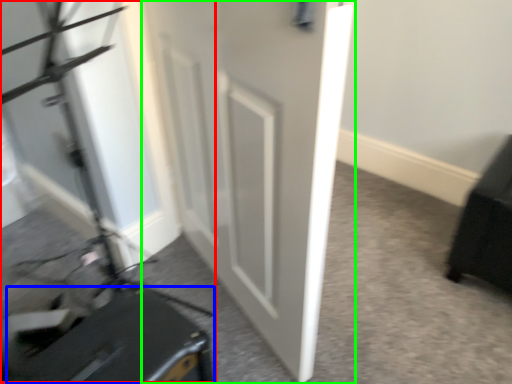
Question: Which object is the closest to the videotape (highlighted by a red box)? Choose among these: luggage (highlighted by a blue box) or door (highlighted by a green box).

Choices:
 (A) luggage
 (B) door

Answer: (A)